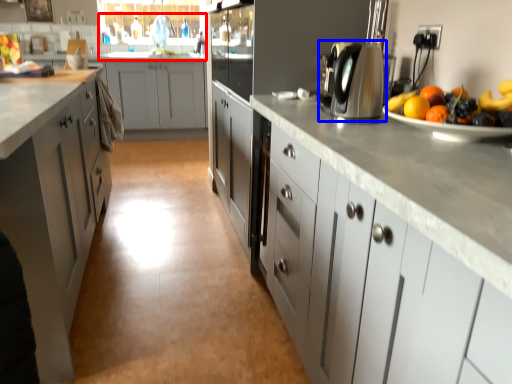
Question: Which of the following is the closest to the observer, sink (highlighted by a red box) or home appliance (highlighted by a blue box)?

Choices:
 (A) sink
 (B) home appliance

Answer: (B)